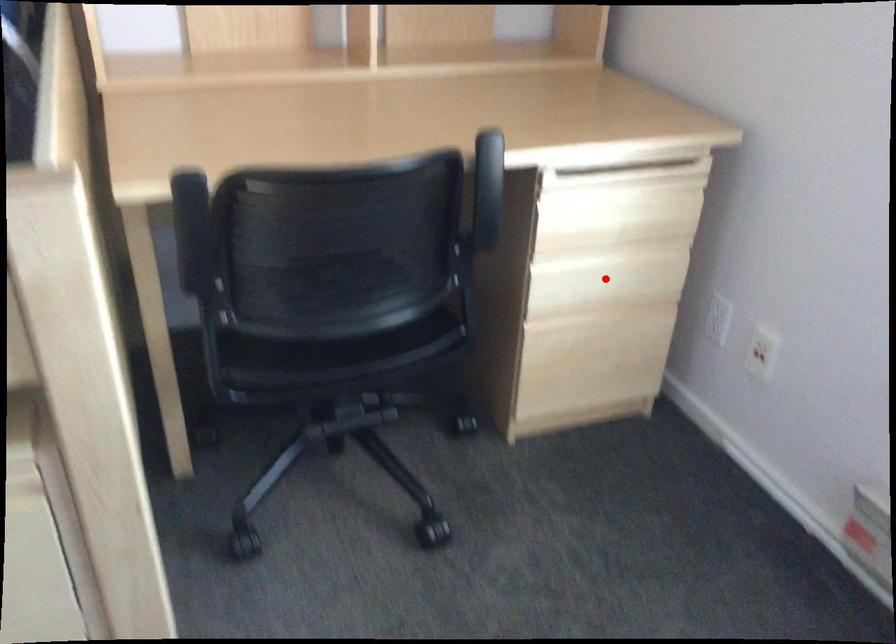
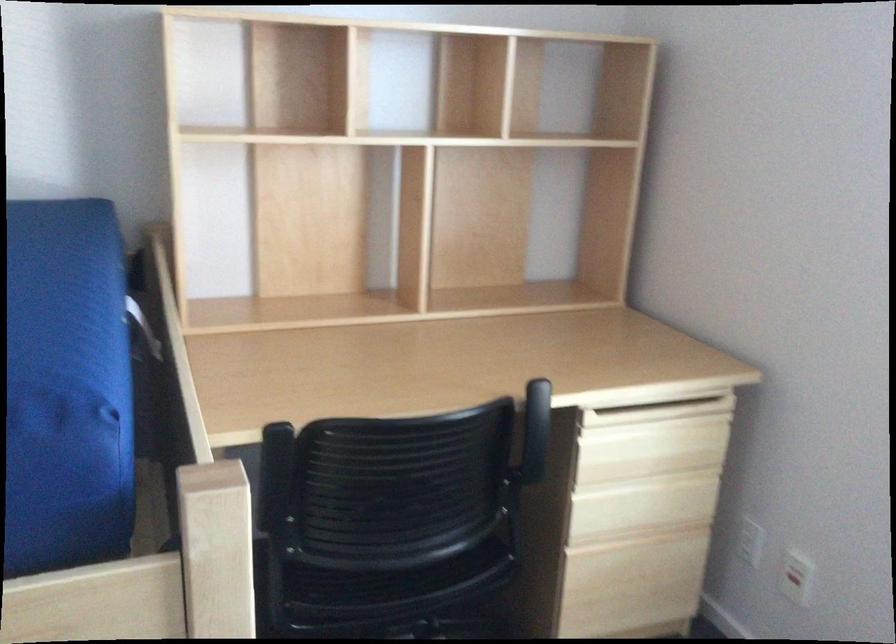
In the second image, find the point that corresponds to the highlighted location in the first image.

(642, 506)